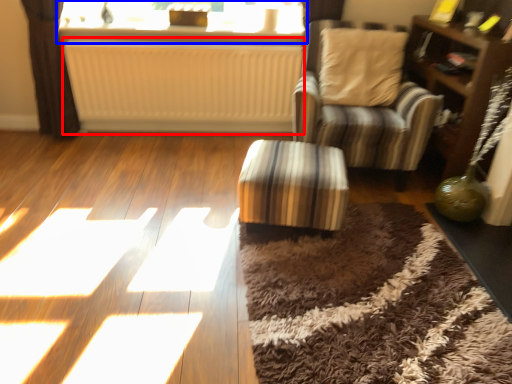
Question: Which of the following is the closest to the observer, radiator (highlighted by a red box) or window (highlighted by a blue box)?

Choices:
 (A) radiator
 (B) window

Answer: (A)